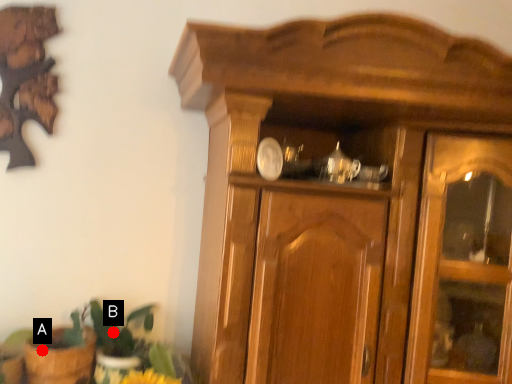
Question: Two points are circled on the image, labeled by A and B beside each circle. Which point is farther to the camera?

Choices:
 (A) A is further
 (B) B is further

Answer: (B)